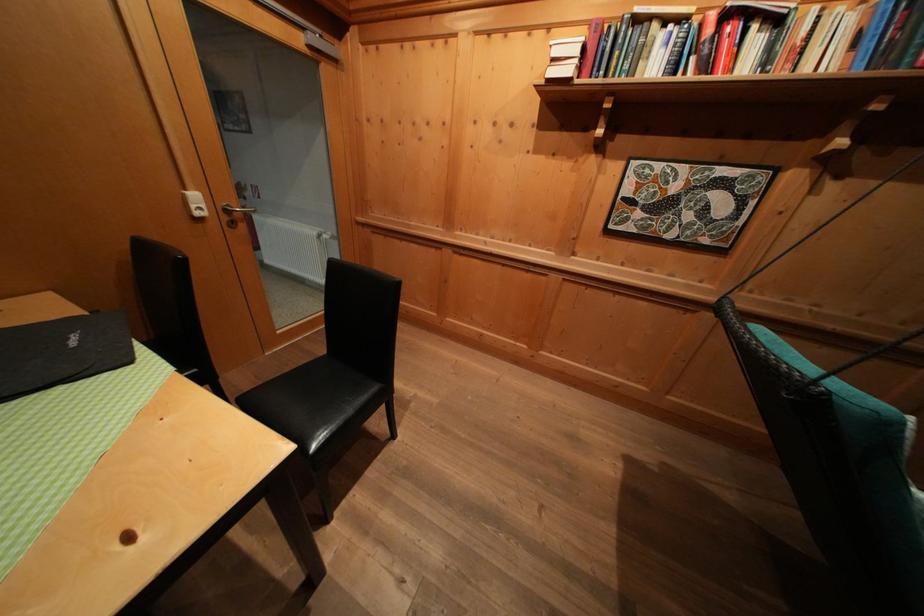
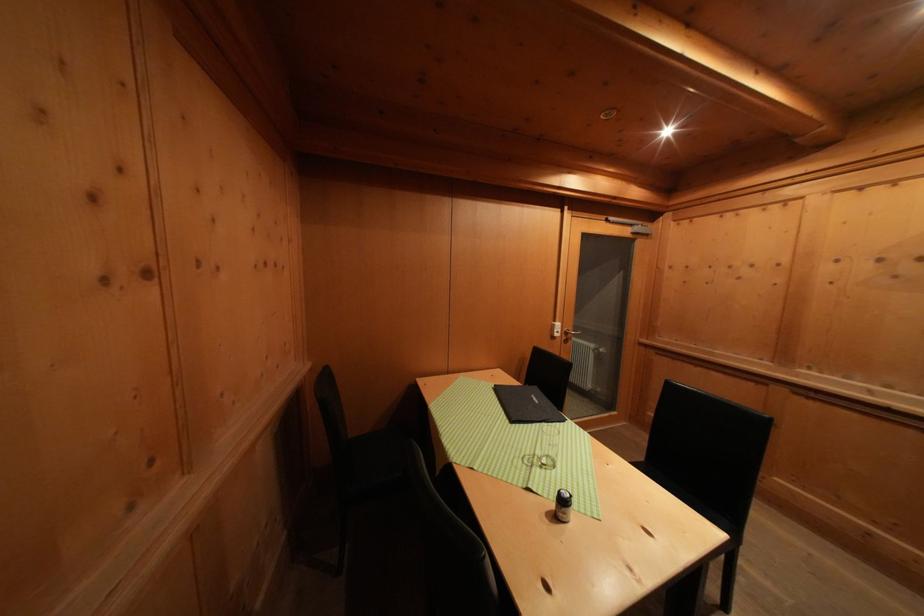
Where in the second image is the point corresponding to point (80, 347) from the first image?

(542, 406)